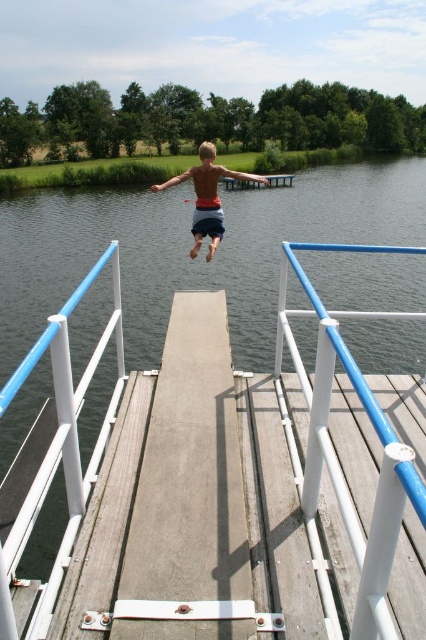
Does transparent water at center have a lesser width compared to white plastic rail at center?

No.

This screenshot has width=426, height=640. What do you see at coordinates (189, 248) in the screenshot?
I see `transparent water at center` at bounding box center [189, 248].

You are a GUI agent. You are given a task and a screenshot of the screen. Output one action in this format:
    pyautogui.click(x=<x>, y=<y>)
    Task: Click on the transparent water at center
    This screenshot has width=426, height=640.
    Given the screenshot: What is the action you would take?
    pyautogui.click(x=189, y=248)

Find the location of `transparent water at center`. transparent water at center is located at coordinates (189, 248).

Is white plastic rail at center to the right of orange t-shirt at center from the viewer's perspective?

Indeed, white plastic rail at center is positioned on the right side of orange t-shirt at center.

Which is below, white plastic rail at center or orange t-shirt at center?

white plastic rail at center is below.

Between point (276, 378) and point (204, 193), which one is positioned behind?

Positioned behind is point (204, 193).

Find the location of `white plastic rail at center`. white plastic rail at center is located at coordinates (337, 454).

Which is more to the left, transparent water at center or orange t-shirt at center?

orange t-shirt at center is more to the left.

Between point (169, 193) and point (198, 186), which one is positioned behind?

Positioned behind is point (169, 193).

At what (x,y) coordinates should I click in order to perform the action: click on transparent water at center. Please return your answer as a coordinate pair (x, y). Looking at the image, I should click on (189, 248).